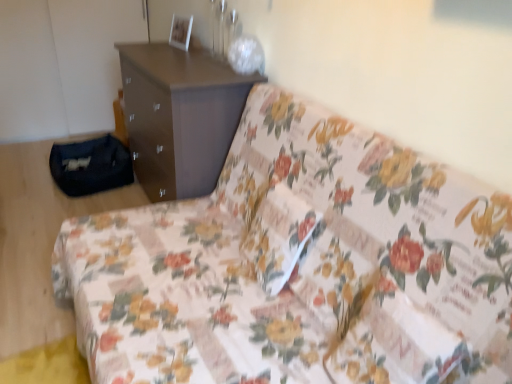
What are the coordinates of `floral fabric couch at center` in the screenshot? It's located at (298, 266).

Where is `brown matte chest of drawers at upper center`? This screenshot has height=384, width=512. brown matte chest of drawers at upper center is located at coordinates (180, 116).

Identify the location of floral fabric couch at center. The image size is (512, 384). (298, 266).

Is point (317, 137) farther from camera compared to point (264, 280)?

Yes.

Looking at this image, is floral fabric couch at center facing towards floral fabric pillow at center?

Yes, floral fabric couch at center faces towards floral fabric pillow at center.

Between floral fabric couch at center and floral fabric pillow at center, which one has less height?

floral fabric pillow at center is shorter.

From the image's perspective, is floral fabric couch at center over brown matte chest of drawers at upper center?

No, from the image's perspective, floral fabric couch at center is not over brown matte chest of drawers at upper center.

Which of these two, floral fabric couch at center or brown matte chest of drawers at upper center, stands taller?

brown matte chest of drawers at upper center is taller.

Is the depth of floral fabric couch at center less than that of brown matte chest of drawers at upper center?

That is True.

Between floral fabric pillow at center and brown matte chest of drawers at upper center, which one has less height?

With less height is floral fabric pillow at center.

At what (x,y) coordinates should I click in order to perform the action: click on the chest of drawers that appears above the floral fabric pillow at center (from the image's perspective). Please return your answer as a coordinate pair (x, y). The image size is (512, 384). Looking at the image, I should click on (180, 116).

Does floral fabric pillow at center lie in front of brown matte chest of drawers at upper center?

Yes, floral fabric pillow at center is closer to the camera.

Is floral fabric pillow at center positioned with its back to brown matte chest of drawers at upper center?

No.

Which object is more forward, brown matte chest of drawers at upper center or floral fabric pillow at center?

floral fabric pillow at center.

Is brown matte chest of drawers at upper center not close to floral fabric pillow at center?

brown matte chest of drawers at upper center is near floral fabric pillow at center, not far away.

From the picture: From a real-world perspective, is brown matte chest of drawers at upper center positioned over floral fabric pillow at center based on gravity?

No, from a real-world perspective, brown matte chest of drawers at upper center is not above floral fabric pillow at center.

From a real-world perspective, between floral fabric pillow at center and floral fabric couch at center, who is vertically higher?

From a 3D spatial view, floral fabric pillow at center is above.

Is floral fabric pillow at center shorter than floral fabric couch at center?

Yes.

Consider the image. Which is less distant, (262, 231) or (264, 187)?

The point (262, 231) is in front.

Would you say floral fabric couch at center is part of floral fabric pillow at center's contents?

No, floral fabric pillow at center does not contain floral fabric couch at center.

Is point (151, 162) positioned in front of point (383, 354)?

No, (151, 162) is further to viewer.

Does brown matte chest of drawers at upper center appear on the right side of floral fabric couch at center?

In fact, brown matte chest of drawers at upper center is to the left of floral fabric couch at center.

From a real-world perspective, relative to floral fabric couch at center, is brown matte chest of drawers at upper center vertically above or below?

brown matte chest of drawers at upper center is situated lower than floral fabric couch at center in the real world.

What's the angular difference between brown matte chest of drawers at upper center and floral fabric couch at center's facing directions?

The facing directions of brown matte chest of drawers at upper center and floral fabric couch at center are 1.03 degrees apart.

You are a GUI agent. You are given a task and a screenshot of the screen. Output one action in this format:
    pyautogui.click(x=<x>, y=<y>)
    Task: Click on the pillow behind the floral fabric couch at center
    This screenshot has height=384, width=512.
    Given the screenshot: What is the action you would take?
    pyautogui.click(x=278, y=236)

The height and width of the screenshot is (384, 512). There is a brown matte chest of drawers at upper center. In order to click on studio couch above it (from a real-world perspective) in this screenshot , I will do `click(298, 266)`.

Which object lies nearer to the anchor point floral fabric couch at center, brown matte chest of drawers at upper center or floral fabric pillow at center?

floral fabric pillow at center.

Based on their spatial positions, is brown matte chest of drawers at upper center or floral fabric couch at center closer to floral fabric pillow at center?

Based on the image, floral fabric couch at center appears to be nearer to floral fabric pillow at center.

Considering their positions, is floral fabric pillow at center positioned closer to brown matte chest of drawers at upper center than floral fabric couch at center?

floral fabric couch at center.

Looking at the image, which one is located closer to brown matte chest of drawers at upper center, floral fabric couch at center or floral fabric pillow at center?

floral fabric couch at center is closer to brown matte chest of drawers at upper center.

From the image, which object appears to be nearer to floral fabric pillow at center, floral fabric couch at center or brown matte chest of drawers at upper center?

floral fabric couch at center.

Considering their positions, is floral fabric pillow at center positioned further to floral fabric couch at center than brown matte chest of drawers at upper center?

Based on the image, brown matte chest of drawers at upper center appears to be further to floral fabric couch at center.

You are a GUI agent. You are given a task and a screenshot of the screen. Output one action in this format:
    pyautogui.click(x=<x>, y=<y>)
    Task: Click on the pillow positioned between floral fabric couch at center and brown matte chest of drawers at upper center from near to far
    
    Given the screenshot: What is the action you would take?
    pyautogui.click(x=278, y=236)